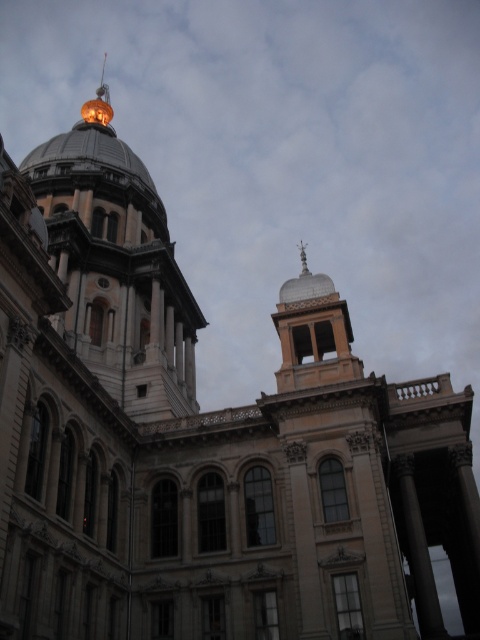
You are standing in front of the grand historic building and want to take a photo of both the shiny gold dome at upper left and the silver metallic dome at upper center. Which dome should you adjust your camera focus on first to ensure both are in clear view?

The shiny gold dome at upper left is closer to you than the silver metallic dome at upper center. To ensure both are in clear view, focus on the shiny gold dome at upper left first, as it is nearer, and adjust the focus range to include the farther silver metallic dome at upper center.

You are standing in front of the grand historic building and notice two points marked on the building. The first point is at coordinates point (67, 317) and the second point is at point (303, 294). From your perspective, which point is closer to you?

Point (303, 294) is closer to you because it is in front of point (67, 317).

You are an architect analyzing the building structure. Which dome, the shiny gold dome at upper left or the silver metallic dome at upper center, is positioned higher in the image?

The shiny gold dome at upper left is positioned higher than the silver metallic dome at upper center.